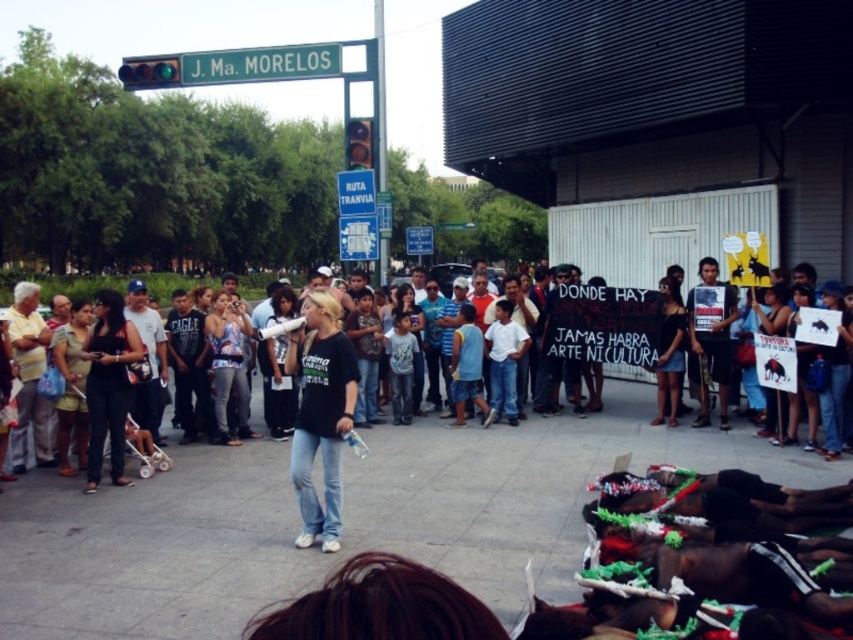
Who is more forward, (x=331, y=58) or (x=334, y=413)?

Point (x=334, y=413)

Which of these two, green metallic street sign at upper left or black matte shirt at center, stands taller?

Standing taller between the two is green metallic street sign at upper left.

The height and width of the screenshot is (640, 853). Identify the location of green metallic street sign at upper left. (x=282, y=81).

Locate an element on the screen. The width and height of the screenshot is (853, 640). green metallic street sign at upper left is located at coordinates (282, 81).

Can you confirm if black matte shirt at center is taller than black fabric shirt at center?

Indeed, black matte shirt at center has a greater height compared to black fabric shirt at center.

From the picture: Can you confirm if black matte shirt at center is bigger than black fabric shirt at center?

Yes.

Does point (328, 310) lie behind point (91, 332)?

No, (328, 310) is closer to viewer.

Where is `black matte shirt at center`? The height and width of the screenshot is (640, 853). black matte shirt at center is located at coordinates (320, 413).

Is green metallic street sign at upper left shorter than black fabric shirt at center?

No, green metallic street sign at upper left is not shorter than black fabric shirt at center.

Who is higher up, green metallic street sign at upper left or black fabric shirt at center?

Positioned higher is green metallic street sign at upper left.

Does point (345, 86) come behind point (80, 353)?

Yes, it is behind point (80, 353).

Find the location of a particular element. The width and height of the screenshot is (853, 640). green metallic street sign at upper left is located at coordinates (282, 81).